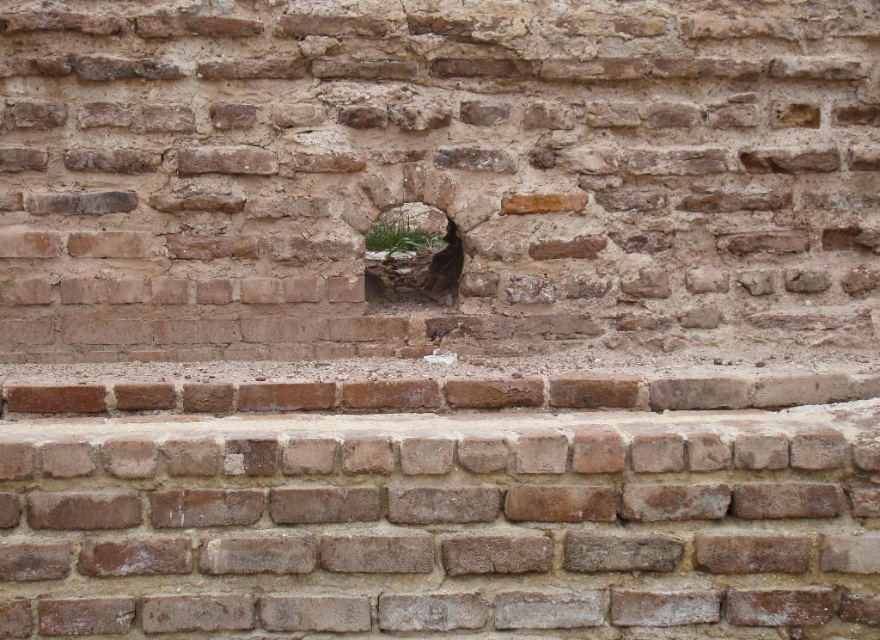
Who is taller, green mossy rock at center or green grass at center?

green mossy rock at center

Locate an element on the screen. green mossy rock at center is located at coordinates (412, 257).